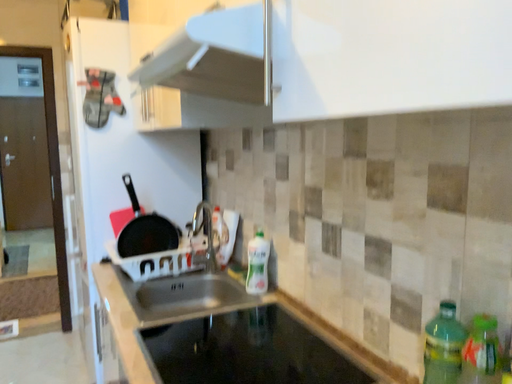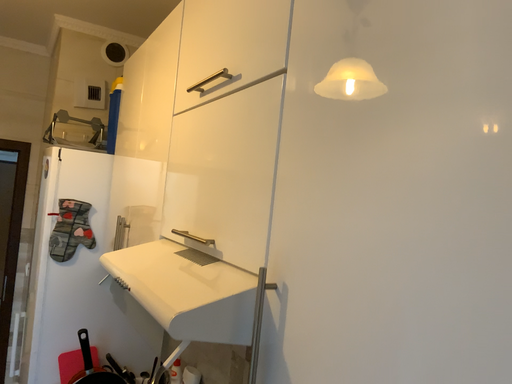
Question: How did the camera likely rotate when shooting the video?

Choices:
 (A) rotated downward
 (B) rotated upward

Answer: (B)